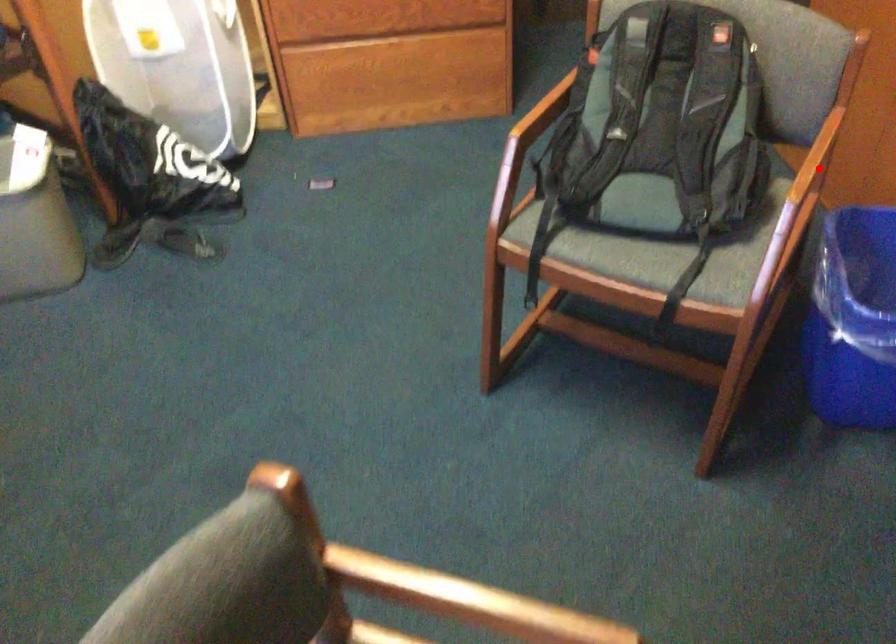
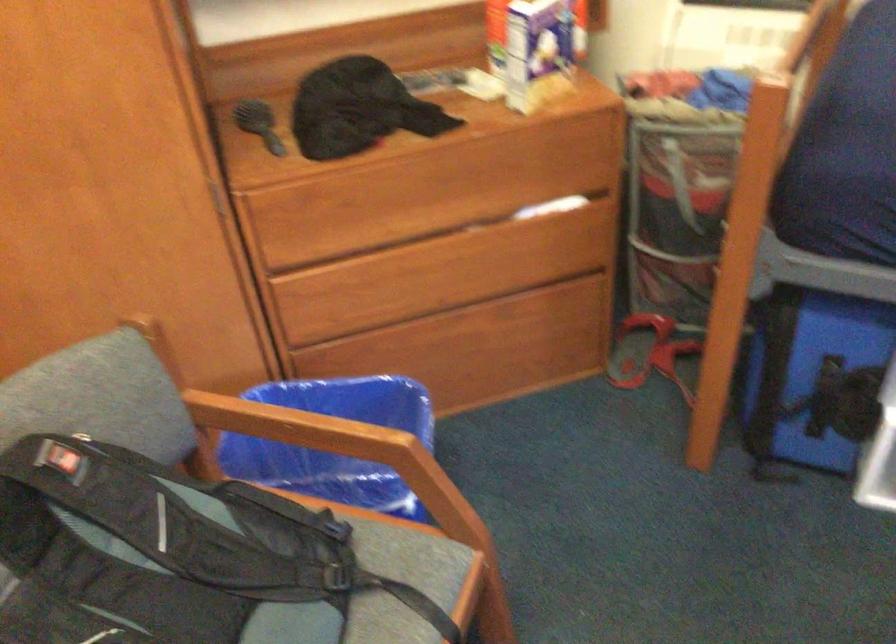
Question: A red point is marked in image1. In image2, is the corresponding 3D point closer to the camera or farther? Reply with the corresponding letter.

Choices:
 (A) The corresponding 3D point is closer.
 (B) The corresponding 3D point is farther.

Answer: (A)